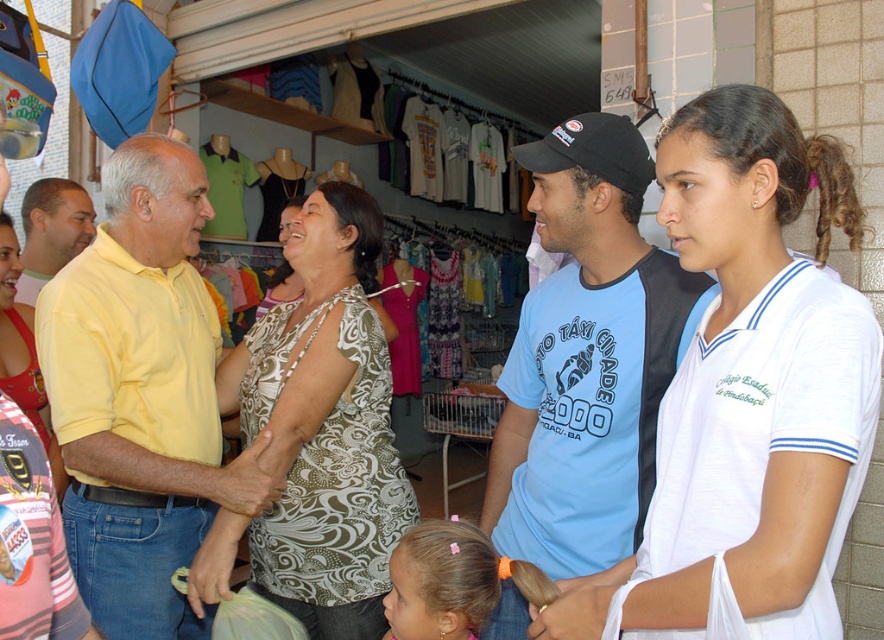
You are a customer in the shop and want to examine the printed fabric blouse at center and the yellow matte shirt at left. Which one can you see more clearly from your current position?

The printed fabric blouse at center is closer to the viewer than the yellow matte shirt at left, so you can see the printed fabric blouse at center more clearly.

You are a customer in the shop and want to buy the printed fabric blouse at center and the black fabric baseball cap at center. Which item is placed higher on the shelf?

The black fabric baseball cap at center is placed higher on the shelf because the printed fabric blouse at center is located below it.